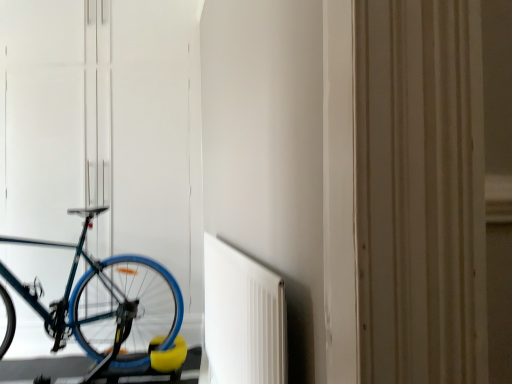
Image resolution: width=512 pixels, height=384 pixels. I want to click on white matte radiator at center, so click(x=243, y=318).

This screenshot has width=512, height=384. Describe the element at coordinates (243, 318) in the screenshot. I see `white matte radiator at center` at that location.

Measure the distance between point [121,334] and camera.

8.94 feet.

Identify the location of teal matte bicycle at left. (113, 309).

What do you see at coordinates (113, 309) in the screenshot?
I see `teal matte bicycle at left` at bounding box center [113, 309].

Measure the distance between teal matte bicycle at left and camera.

The depth of teal matte bicycle at left is 8.34 feet.

What are the coordinates of `white matte radiator at center` in the screenshot? It's located at (243, 318).

Considering the relative positions of teal matte bicycle at left and white matte radiator at center in the image provided, is teal matte bicycle at left to the left of white matte radiator at center from the viewer's perspective?

Indeed, teal matte bicycle at left is positioned on the left side of white matte radiator at center.

Does teal matte bicycle at left lie behind white matte radiator at center?

Yes, teal matte bicycle at left is behind white matte radiator at center.

Is point (104, 278) positioned after point (274, 358)?

Yes, point (104, 278) is behind point (274, 358).

From the image's perspective, who appears lower, teal matte bicycle at left or white matte radiator at center?

white matte radiator at center.

From a real-world perspective, which object rests below the other?

white matte radiator at center.

Can you confirm if teal matte bicycle at left is wider than white matte radiator at center?

Yes, teal matte bicycle at left is wider than white matte radiator at center.

Is teal matte bicycle at left taller than white matte radiator at center?

Yes.

Which of these two, teal matte bicycle at left or white matte radiator at center, is smaller?

white matte radiator at center is smaller.

Consider the image. Is white matte radiator at center surrounded by teal matte bicycle at left?

No, teal matte bicycle at left does not contain white matte radiator at center.

Would you consider teal matte bicycle at left to be distant from white matte radiator at center?

Yes, teal matte bicycle at left and white matte radiator at center are located far from each other.

Is teal matte bicycle at left oriented towards white matte radiator at center?

No, teal matte bicycle at left is not oriented towards white matte radiator at center.

How many degrees apart are the facing directions of teal matte bicycle at left and white matte radiator at center?

They differ by 11.7 degrees in their facing directions.

Where is `radiator on the right of teal matte bicycle at left`? The height and width of the screenshot is (384, 512). radiator on the right of teal matte bicycle at left is located at coordinates (243, 318).

Which is more to the right, white matte radiator at center or teal matte bicycle at left?

white matte radiator at center.

Considering the positions of objects white matte radiator at center and teal matte bicycle at left in the image provided, who is behind, white matte radiator at center or teal matte bicycle at left?

teal matte bicycle at left is behind.

Between point (230, 339) and point (2, 349), which one is positioned in front?

The point (230, 339) is closer.

From the image's perspective, is white matte radiator at center positioned above or below teal matte bicycle at left?

Based on their image positions, white matte radiator at center is located beneath teal matte bicycle at left.

From a real-world perspective, is white matte radiator at center over teal matte bicycle at left?

No, from a real-world perspective, white matte radiator at center is not on top of teal matte bicycle at left.

Between white matte radiator at center and teal matte bicycle at left, which one has larger width?

teal matte bicycle at left.

Who is shorter, white matte radiator at center or teal matte bicycle at left?

With less height is white matte radiator at center.

Considering the relative sizes of white matte radiator at center and teal matte bicycle at left in the image provided, is white matte radiator at center smaller than teal matte bicycle at left?

Yes.

Would you say white matte radiator at center is inside or outside teal matte bicycle at left?

white matte radiator at center is spatially situated outside teal matte bicycle at left.

Is white matte radiator at center beside teal matte bicycle at left?

There is a gap between white matte radiator at center and teal matte bicycle at left.

Does white matte radiator at center turn towards teal matte bicycle at left?

Yes, white matte radiator at center faces towards teal matte bicycle at left.

In the scene shown: Can you tell me how much white matte radiator at center and teal matte bicycle at left differ in facing direction?

The facing directions of white matte radiator at center and teal matte bicycle at left are 11.7 degrees apart.

Where is `bicycle above the white matte radiator at center (from a real-world perspective)`? The height and width of the screenshot is (384, 512). bicycle above the white matte radiator at center (from a real-world perspective) is located at coordinates (113, 309).

Where is `radiator directly beneath the teal matte bicycle at left (from a real-world perspective)`? This screenshot has height=384, width=512. radiator directly beneath the teal matte bicycle at left (from a real-world perspective) is located at coordinates (243, 318).

In order to click on bicycle on the left of white matte radiator at center in this screenshot , I will do `click(113, 309)`.